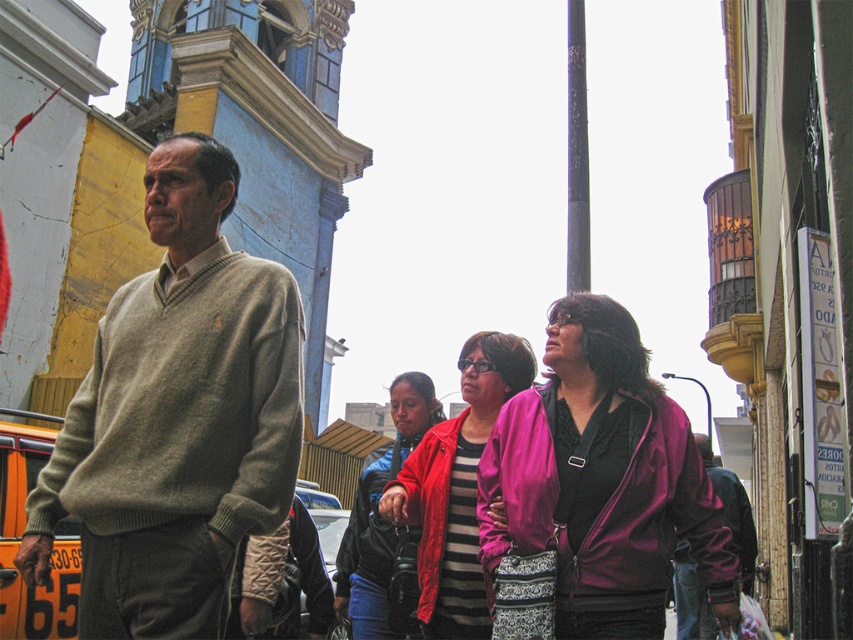
Question: Is light beige sweater at center positioned at the back of purple matte jacket at center?

Choices:
 (A) yes
 (B) no

Answer: (B)

Question: Which object appears farthest from the camera in this image?

Choices:
 (A) matte green sweater at center
 (B) purple matte jacket at center

Answer: (A)

Question: Is purple matte jacket at center wider than red jacket at center?

Choices:
 (A) yes
 (B) no

Answer: (A)

Question: Which of these objects is positioned closest to the matte green sweater at left?

Choices:
 (A) light beige sweater at center
 (B) striped fabric jacket at center
 (C) red jacket at center

Answer: (C)

Question: Which point is closer to the camera?

Choices:
 (A) red jacket at center
 (B) matte green sweater at left

Answer: (B)

Question: Is purple matte jacket at center positioned at the back of matte green sweater at center?

Choices:
 (A) no
 (B) yes

Answer: (A)